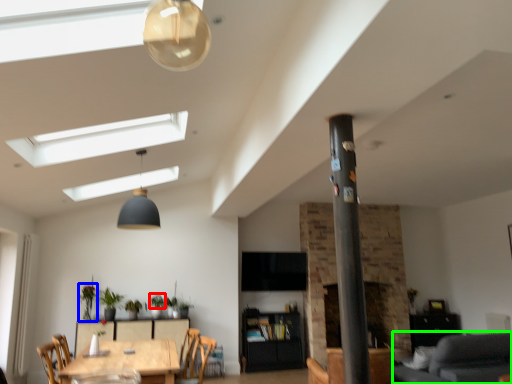
Question: Estimate the real-world distances between objects in this image. Which object is farther from plant (highlighted by a red box), plant (highlighted by a blue box) or couch (highlighted by a green box)?

Choices:
 (A) plant
 (B) couch

Answer: (B)